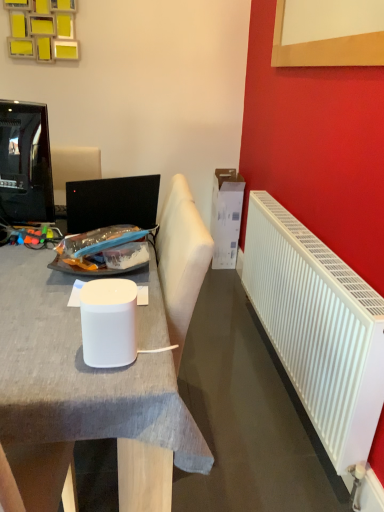
At what (x,y) coordinates should I click in order to perform the action: click on vacant space that is to the left of white glossy paper cup at center. Please return your answer as a coordinate pair (x, y). The height and width of the screenshot is (512, 384). Looking at the image, I should click on (43, 346).